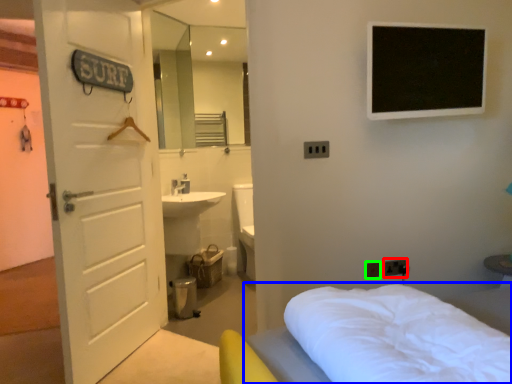
Question: Estimate the real-world distances between objects in this image. Which object is closer to electric outlet (highlighted by a red box), bed (highlighted by a blue box) or electric outlet (highlighted by a green box)?

Choices:
 (A) bed
 (B) electric outlet

Answer: (B)